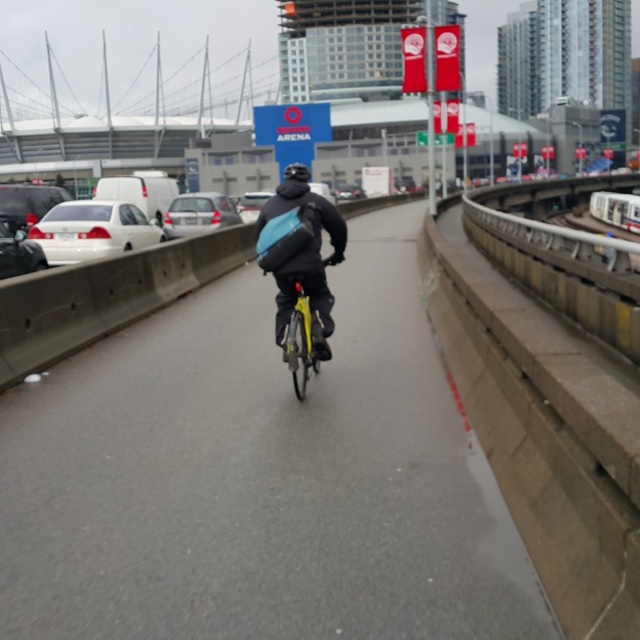
Does yellow matte bicycle at center have a lesser height compared to silver metallic sedan at center?

Indeed, yellow matte bicycle at center has a lesser height compared to silver metallic sedan at center.

Consider the image. Can you confirm if yellow matte bicycle at center is positioned to the right of silver metallic sedan at center?

Correct, you'll find yellow matte bicycle at center to the right of silver metallic sedan at center.

Locate an element on the screen. yellow matte bicycle at center is located at coordinates (301, 337).

Does matte black jacket at center appear on the right side of silver metallic sedan at center?

Indeed, matte black jacket at center is positioned on the right side of silver metallic sedan at center.

Which is in front, point (310, 316) or point (182, 195)?

Positioned in front is point (310, 316).

Where is `matte black jacket at center`? The height and width of the screenshot is (640, 640). matte black jacket at center is located at coordinates (300, 268).

Who is lower down, matte black bicycle at center or matte black jacket at center?

matte black bicycle at center is lower down.

Does matte black bicycle at center have a greater height compared to matte black jacket at center?

Incorrect, matte black bicycle at center's height is not larger of matte black jacket at center's.

Is point (129, 596) behind point (340, 228)?

No, it is in front of (340, 228).

Find the location of a particular element. This screenshot has width=640, height=640. matte black bicycle at center is located at coordinates (259, 476).